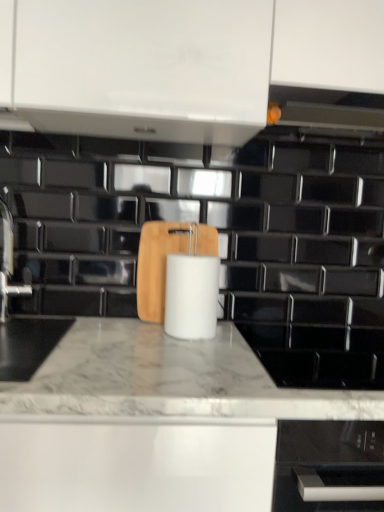
From the picture: What is the approximate width of white matte paper towel at center?

5.08 inches.

This screenshot has height=512, width=384. Identify the location of white matte paper towel at center. (191, 296).

Between white marble countertop at center and white matte paper towel at center, which one has more height?

white marble countertop at center is taller.

Where is `countertop in front of the white matte paper towel at center`? countertop in front of the white matte paper towel at center is located at coordinates (152, 422).

Considering the relative sizes of white marble countertop at center and white matte paper towel at center in the image provided, is white marble countertop at center wider than white matte paper towel at center?

Correct, the width of white marble countertop at center exceeds that of white matte paper towel at center.

Which object is further away from the camera taking this photo, white marble countertop at center or white matte paper towel at center?

white matte paper towel at center is behind.

Is white matte paper towel at center to the left or to the right of wooden cutting board at center in the image?

Clearly, white matte paper towel at center is on the right of wooden cutting board at center in the image.

In the image, is white matte paper towel at center positioned in front of or behind wooden cutting board at center?

white matte paper towel at center is in front of wooden cutting board at center.

Is white matte paper towel at center facing towards wooden cutting board at center?

No, white matte paper towel at center is not aimed at wooden cutting board at center.

Could wooden cutting board at center be considered to be inside white matte paper towel at center?

No, wooden cutting board at center is not inside white matte paper towel at center.

From a real-world perspective, which is physically below, white marble countertop at center or satin nickel faucet at left?

white marble countertop at center is physically lower.

Does point (255, 362) come behind point (9, 294)?

That is False.

Measure the distance from white marble countertop at center to satin nickel faucet at left.

25.62 inches.

Can you tell me how much white marble countertop at center and satin nickel faucet at left differ in facing direction?

42.3 degrees separate the facing orientations of white marble countertop at center and satin nickel faucet at left.

Is satin nickel faucet at left not near wooden cutting board at center?

Actually, satin nickel faucet at left and wooden cutting board at center are a little close together.

Can you confirm if satin nickel faucet at left is wider than wooden cutting board at center?

Indeed, satin nickel faucet at left has a greater width compared to wooden cutting board at center.

Can you confirm if satin nickel faucet at left is smaller than wooden cutting board at center?

Correct, satin nickel faucet at left occupies less space than wooden cutting board at center.

Where is `faucet above the wooden cutting board at center (from the image's perspective)`? faucet above the wooden cutting board at center (from the image's perspective) is located at coordinates (8, 265).

Does wooden cutting board at center come behind satin nickel faucet at left?

Yes, it is behind satin nickel faucet at left.

Based on their sizes in the image, would you say wooden cutting board at center is bigger or smaller than satin nickel faucet at left?

Clearly, wooden cutting board at center is larger in size than satin nickel faucet at left.

How much distance is there between satin nickel faucet at left and white marble countertop at center?

satin nickel faucet at left and white marble countertop at center are 65.07 centimeters apart from each other.

The image size is (384, 512). In order to click on countertop in front of the satin nickel faucet at left in this screenshot , I will do `click(152, 422)`.

From the image's perspective, is satin nickel faucet at left above white marble countertop at center?

Indeed, from the image's perspective, satin nickel faucet at left is shown above white marble countertop at center.

Is satin nickel faucet at left oriented towards white marble countertop at center?

No, satin nickel faucet at left is not facing towards white marble countertop at center.

Which object is wider, wooden cutting board at center or white matte paper towel at center?

Wider between the two is white matte paper towel at center.

Measure the distance between wooden cutting board at center and white matte paper towel at center.

They are 5.68 inches apart.

Based on the photo, which object is closer to the camera, wooden cutting board at center or white matte paper towel at center?

white matte paper towel at center is more forward.

From the image's perspective, between wooden cutting board at center and white matte paper towel at center, which one is located above?

wooden cutting board at center, from the image's perspective.

This screenshot has height=512, width=384. What are the coordinates of `paper towel that is on the left side of white marble countertop at center` in the screenshot? It's located at (191, 296).

What are the coordinates of `cutting board behind the white matte paper towel at center` in the screenshot? It's located at (166, 260).

Considering their positions, is wooden cutting board at center positioned further to satin nickel faucet at left than white marble countertop at center?

white marble countertop at center is positioned further to the anchor satin nickel faucet at left.

From the image, which object appears to be nearer to wooden cutting board at center, white matte paper towel at center or satin nickel faucet at left?

white matte paper towel at center.

When comparing their distances from white matte paper towel at center, does wooden cutting board at center or satin nickel faucet at left seem closer?

wooden cutting board at center.

When comparing their distances from wooden cutting board at center, does white matte paper towel at center or white marble countertop at center seem further?

white marble countertop at center.

Looking at the image, which one is located further to white matte paper towel at center, white marble countertop at center or wooden cutting board at center?

Among the two, white marble countertop at center is located further to white matte paper towel at center.

Based on their spatial positions, is white matte paper towel at center or satin nickel faucet at left closer to white marble countertop at center?

Based on the image, white matte paper towel at center appears to be nearer to white marble countertop at center.

Considering their positions, is wooden cutting board at center positioned further to white marble countertop at center than white matte paper towel at center?

wooden cutting board at center.

From the image, which object appears to be nearer to satin nickel faucet at left, white marble countertop at center or wooden cutting board at center?

Among the two, wooden cutting board at center is located nearer to satin nickel faucet at left.

Where is `cutting board between satin nickel faucet at left and white matte paper towel at center from left to right`? This screenshot has height=512, width=384. cutting board between satin nickel faucet at left and white matte paper towel at center from left to right is located at coordinates (166, 260).

Identify the location of paper towel located between satin nickel faucet at left and white marble countertop at center in the left-right direction. The height and width of the screenshot is (512, 384). (191, 296).

At what (x,y) coordinates should I click in order to perform the action: click on cutting board between satin nickel faucet at left and white marble countertop at center in the horizontal direction. Please return your answer as a coordinate pair (x, y). The height and width of the screenshot is (512, 384). Looking at the image, I should click on (166, 260).

Find the location of a particular element. This screenshot has width=384, height=512. paper towel between wooden cutting board at center and white marble countertop at center in the vertical direction is located at coordinates (191, 296).